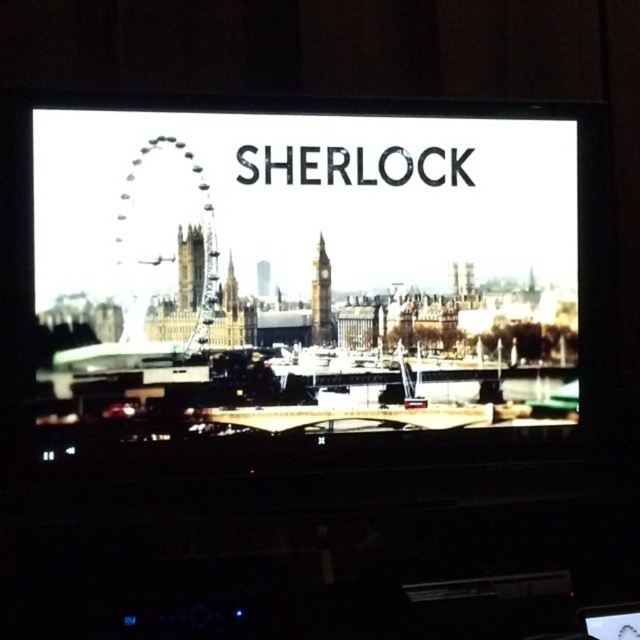
Question: Is matte black screen at center thinner than stone clock tower at center?

Choices:
 (A) yes
 (B) no

Answer: (B)

Question: Is matte black screen at center positioned at the back of stone clock tower at center?

Choices:
 (A) no
 (B) yes

Answer: (A)

Question: In this image, where is matte black screen at center located relative to stone clock tower at center?

Choices:
 (A) above
 (B) below

Answer: (A)